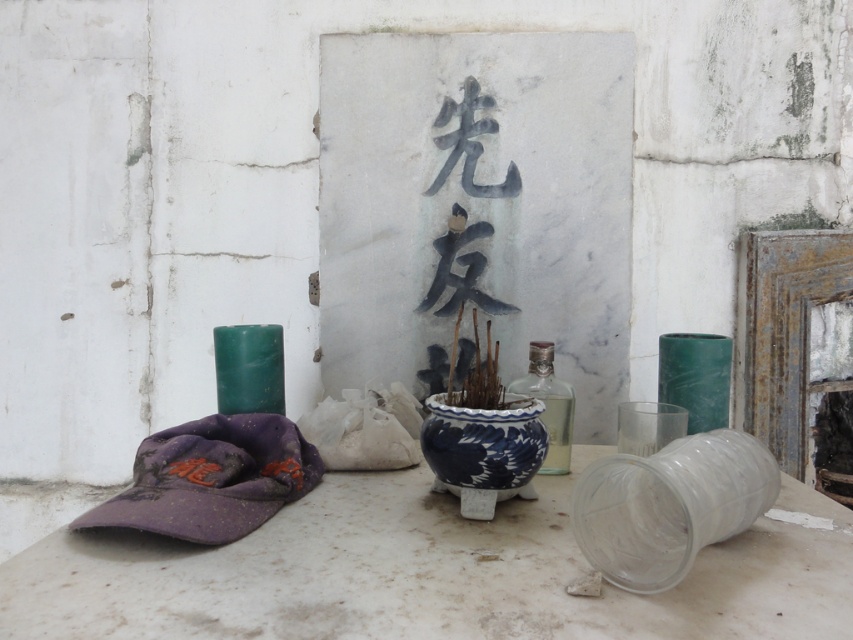
Question: Considering the real-world distances, which object is closest to the white marble table at center?

Choices:
 (A) blue porcelain pot at center
 (B) rusty metal fireplace at right
 (C) transparent plastic cup at lower right

Answer: (C)

Question: Does blue porcelain pot at center have a smaller size compared to clear glass bottle at center?

Choices:
 (A) yes
 (B) no

Answer: (A)

Question: Which of the following is the farthest from the observer?

Choices:
 (A) rusty metal fireplace at right
 (B) white marble table at center
 (C) blue porcelain pot at center

Answer: (A)

Question: Which object appears closest to the camera in this image?

Choices:
 (A) transparent plastic cup at lower right
 (B) clear glass bottle at center
 (C) rusty metal fireplace at right

Answer: (A)

Question: Is rusty metal fireplace at right in front of clear glass bottle at center?

Choices:
 (A) yes
 (B) no

Answer: (B)

Question: Is rusty metal fireplace at right thinner than clear glass bottle at center?

Choices:
 (A) no
 (B) yes

Answer: (A)